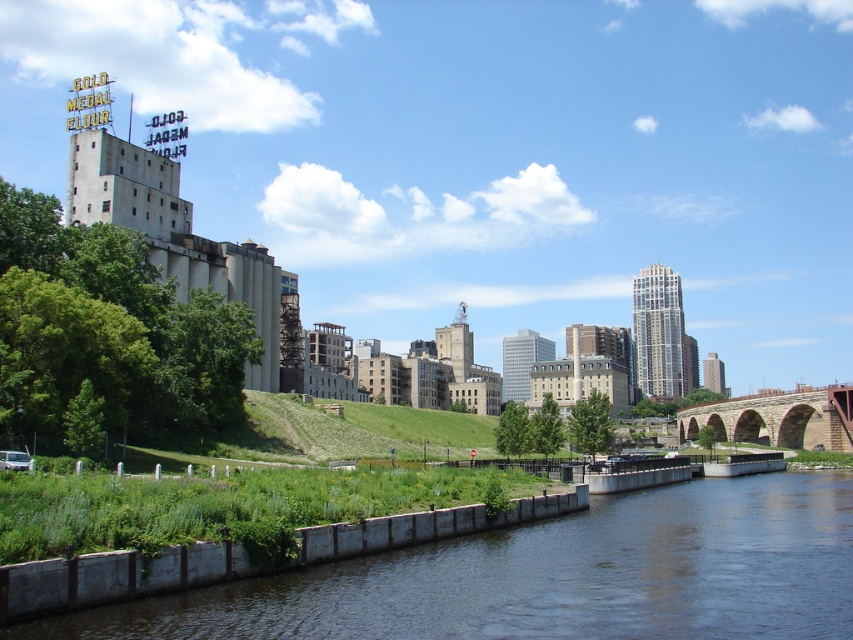
Question: Is the position of dark gray concrete wall at lower center more distant than that of brown stone bridge at lower right?

Choices:
 (A) yes
 (B) no

Answer: (B)

Question: Among these objects, which one is farthest from the camera?

Choices:
 (A) brown stone bridge at lower right
 (B) dark gray concrete wall at lower center

Answer: (A)

Question: Among these points, which one is farthest from the camera?

Choices:
 (A) (792, 448)
 (B) (601, 628)

Answer: (A)

Question: Is dark gray concrete wall at lower center smaller than brown stone bridge at lower right?

Choices:
 (A) yes
 (B) no

Answer: (B)

Question: In this image, where is dark gray concrete wall at lower center located relative to brown stone bridge at lower right?

Choices:
 (A) left
 (B) right

Answer: (A)